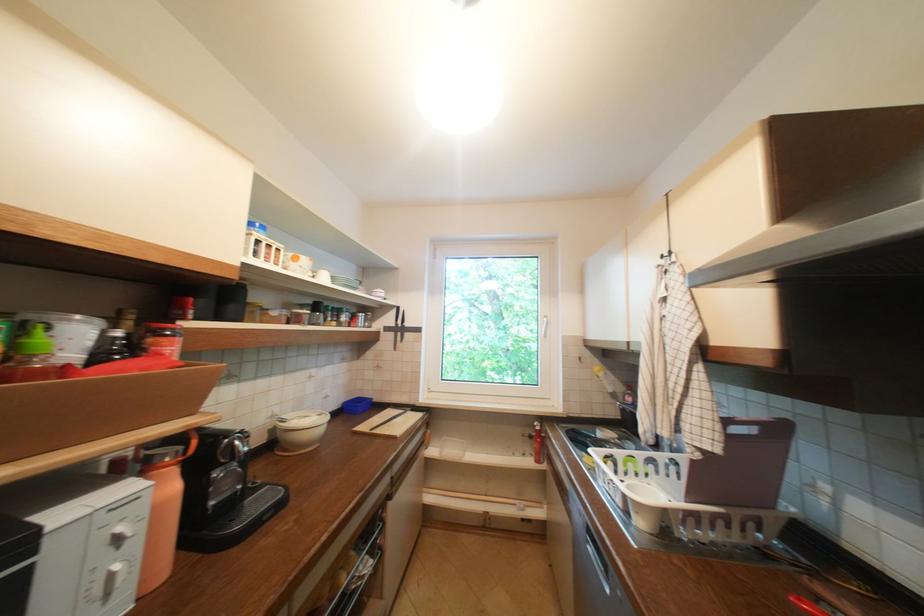
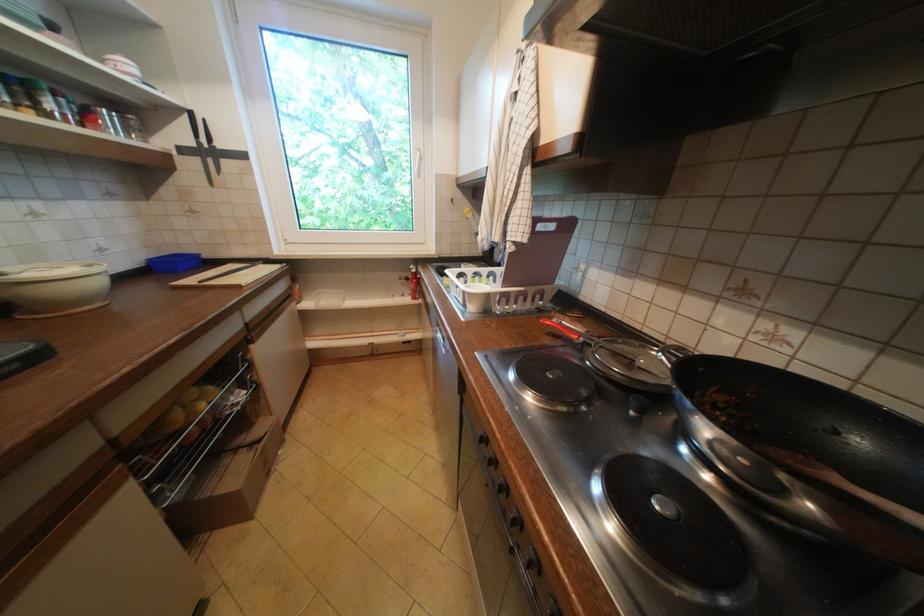
The point at (403, 312) is marked in the first image. Where is the corresponding point in the second image?

(195, 119)